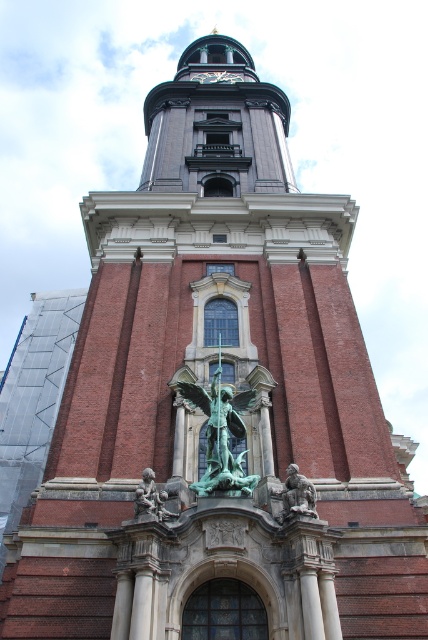
You are an architect designing a new plaza in front of the building. The statues need to be spaced exactly 15 feet apart for aesthetic harmony. Given their current distance of 17.15 feet, how much space should you reduce between the green patina statue at center and the bronze statue at center to meet the requirement?

The current distance between the green patina statue at center and the bronze statue at center is 17.15 feet. To achieve the desired 15 feet spacing, you need to reduce the distance by 2.15 feet.

You are a tour guide leading a group to a grand architectural structure. You want to ensure everyone can see both the bronze statue at center and the green patina statue at lower center from their current position. Given that the minimum viewing distance for comfortable observation is 8 meters, is the spacing between these two statues sufficient?

The distance between the bronze statue at center and the green patina statue at lower center is 8.71 meters, which exceeds the minimum viewing distance of 8 meters. Therefore, the spacing is sufficient for comfortable observation.

You are standing in front of the grand architectural structure described. You notice two statues. The bronze statue at center and the green patina statue at lower center. Which statue is positioned higher up on the facade?

The bronze statue at center is positioned higher up on the facade than the green patina statue at lower center because the bronze statue at center is above the green patina statue at lower center.